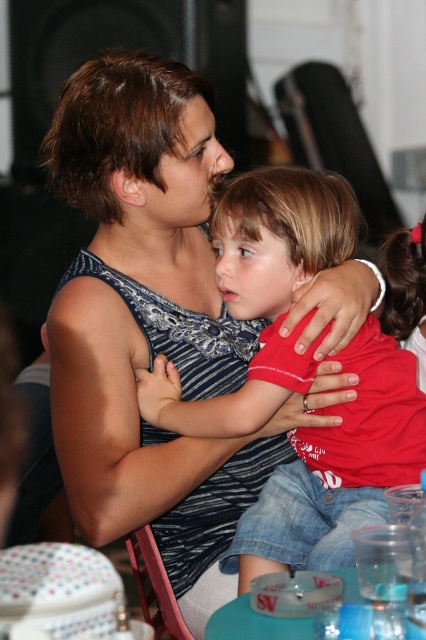
Question: Is smooth red hair at center smaller than wooden chair at lower center?

Choices:
 (A) yes
 (B) no

Answer: (A)

Question: Which point appears farthest from the camera in this image?

Choices:
 (A) (169, 595)
 (B) (307, 369)

Answer: (A)

Question: Which object appears closest to the camera in this image?

Choices:
 (A) wooden chair at lower center
 (B) red matte shirt at center

Answer: (B)

Question: Which of the following is the closest to the observer?

Choices:
 (A) red matte shirt at center
 (B) smooth red hair at center

Answer: (A)

Question: Is red matte shirt at center thinner than smooth red hair at center?

Choices:
 (A) no
 (B) yes

Answer: (A)

Question: Is the position of red matte shirt at center more distant than that of smooth red hair at center?

Choices:
 (A) yes
 (B) no

Answer: (B)